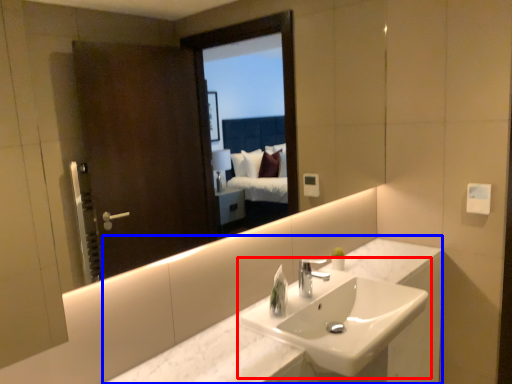
Question: Which of the following is the farthest to the observer, sink (highlighted by a red box) or counter (highlighted by a blue box)?

Choices:
 (A) sink
 (B) counter

Answer: (A)